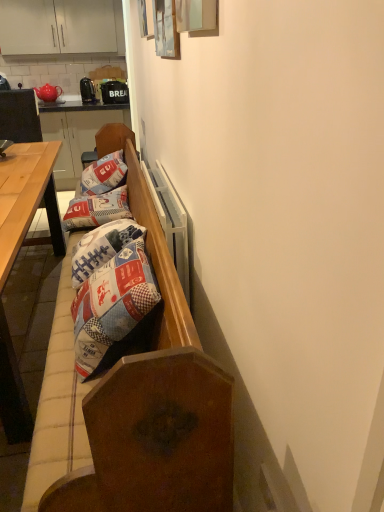
Where is `patchwork fabric pillow at center, which is the first pillow in back-to-front order`? patchwork fabric pillow at center, which is the first pillow in back-to-front order is located at coordinates (104, 174).

Where is `metallic black coffee maker at upper left`? metallic black coffee maker at upper left is located at coordinates (87, 91).

Measure the distance between wooden bench at center and camera.

They are 81.40 centimeters apart.

Identify the location of wooden desk at left. (16, 256).

Identify the location of dresser below the matte ceramic teapot at upper left (from the image's perspective). (77, 134).

Is wooden bench at left completely or partially outside of matte ceramic teapot at upper left?

Yes, wooden bench at left is not within matte ceramic teapot at upper left.

Does wooden bench at left appear on the left side of matte ceramic teapot at upper left?

Incorrect, wooden bench at left is not on the left side of matte ceramic teapot at upper left.

From a real-world perspective, which is physically below, wooden bench at left or matte ceramic teapot at upper left?

wooden bench at left is physically lower.

Is light brown wooden table at left next to matte ceramic teapot at upper left?

No.

From the image's perspective, is light brown wooden table at left located above or below matte ceramic teapot at upper left?

Based on their image positions, light brown wooden table at left is located beneath matte ceramic teapot at upper left.

Can you confirm if light brown wooden table at left is wider than matte ceramic teapot at upper left?

Yes.

Would you say light brown wooden table at left is to the left or to the right of matte ceramic teapot at upper left in the picture?

light brown wooden table at left is to the right of matte ceramic teapot at upper left.

Consider the image. Is white matte cabinet at upper left at the back of wooden desk at left?

No, wooden desk at left is not facing away from white matte cabinet at upper left.

Considering the relative sizes of wooden desk at left and white matte cabinet at upper left in the image provided, is wooden desk at left smaller than white matte cabinet at upper left?

No.

Locate an element on the screen. The height and width of the screenshot is (512, 384). desk that appears in front of the white matte cabinet at upper left is located at coordinates (16, 256).

Between wooden desk at left and white matte cabinet at upper left, which one is positioned behind?

white matte cabinet at upper left.

Which object is wider, wooden bench at center or matte ceramic teapot at upper left?

With larger width is wooden bench at center.

Which object is further away from the camera, wooden bench at center or matte ceramic teapot at upper left?

matte ceramic teapot at upper left is further from the camera.

Can you tell me how much wooden bench at center and matte ceramic teapot at upper left differ in facing direction?

wooden bench at center and matte ceramic teapot at upper left are facing 91.3 degrees away from each other.

Is wooden bench at center completely or partially outside of matte ceramic teapot at upper left?

Yes, wooden bench at center is not within matte ceramic teapot at upper left.

From a real-world perspective, which object stands above the other?

matte ceramic teapot at upper left, from a real-world perspective.

Which of these two, matte ceramic teapot at upper left or patchwork fabric pillow at center, the 2th pillow viewed from the front, is smaller?

matte ceramic teapot at upper left.

This screenshot has height=512, width=384. What are the coordinates of `coffee cup located above the patchwork fabric pillow at center, which is the first pillow in back-to-front order (from the image's perspective)` in the screenshot? It's located at (4, 83).

Is matte ceramic teapot at upper left positioned far away from patchwork fabric pillow at center, which is the first pillow in back-to-front order?

Yes, matte ceramic teapot at upper left is far from patchwork fabric pillow at center, which is the first pillow in back-to-front order.

Does white matte cabinet at upper left have a lesser width compared to wooden desk at left?

Yes, white matte cabinet at upper left is thinner than wooden desk at left.

Is white matte cabinet at upper left located outside wooden desk at left?

white matte cabinet at upper left is positioned outside wooden desk at left.

Would you say white matte cabinet at upper left is a long distance from wooden desk at left?

white matte cabinet at upper left is positioned a significant distance from wooden desk at left.

Considering the sizes of objects white matte cabinet at upper left and wooden desk at left in the image provided, who is bigger, white matte cabinet at upper left or wooden desk at left?

Bigger between the two is wooden desk at left.

Can wooden bench at left be found inside wooden desk at left?

Definitely not — wooden bench at left is not inside wooden desk at left.

Considering the relative sizes of wooden desk at left and wooden bench at left in the image provided, is wooden desk at left shorter than wooden bench at left?

Yes, wooden desk at left is shorter than wooden bench at left.

Does wooden desk at left lie in front of wooden bench at left?

Yes, wooden desk at left is closer to the viewer.

From a real-world perspective, which is physically above, wooden desk at left or wooden bench at left?

wooden bench at left, from a real-world perspective.

In the image, there is a matte ceramic teapot at upper left. At what (x,y) coordinates should I click in order to perform the action: click on dresser below it (from the image's perspective). Please return your answer as a coordinate pair (x, y). This screenshot has height=512, width=384. Looking at the image, I should click on (77, 134).

Where is `table located underneath the matte ceramic teapot at upper left (from a real-world perspective)`? table located underneath the matte ceramic teapot at upper left (from a real-world perspective) is located at coordinates [x=27, y=198].

When comparing their distances from patchwork fabric pillow at center, positioned as the second pillow in back-to-front order, does matte ceramic teapot at upper left or wooden bench at center seem further?

matte ceramic teapot at upper left is positioned further to the anchor patchwork fabric pillow at center, positioned as the second pillow in back-to-front order.

Based on their spatial positions, is patchwork fabric pillow at center, which is the first pillow in back-to-front order, or matte ceramic teapot at upper left closer to metallic black coffee maker at upper left?

matte ceramic teapot at upper left is positioned closer to the anchor metallic black coffee maker at upper left.

Which object lies nearer to the anchor point matte ceramic teapot at upper left, light brown wooden table at left or patchwork fabric pillow at center, which is the first pillow in back-to-front order?

patchwork fabric pillow at center, which is the first pillow in back-to-front order, lies closer to matte ceramic teapot at upper left than the other object.

From the image, which object appears to be farther from wooden desk at left, matte ceramic teapot at upper left or wooden bench at left?

The object further to wooden desk at left is matte ceramic teapot at upper left.

Which object lies nearer to the anchor point patchwork fabric pillow at center, positioned as the second pillow in back-to-front order, light brown wooden table at left or patchwork fabric pillow at center, the 2th pillow viewed from the front?

The object closer to patchwork fabric pillow at center, positioned as the second pillow in back-to-front order, is patchwork fabric pillow at center, the 2th pillow viewed from the front.

Looking at the image, which one is located further to white matte cabinet at upper left, matte ceramic teapot at upper left or light brown wooden table at left?

The object further to white matte cabinet at upper left is light brown wooden table at left.

When comparing their distances from light brown wooden table at left, does patchwork fabric pillow at center, which is the first pillow in back-to-front order, or matte ceramic teapot at upper left seem further?

Based on the image, matte ceramic teapot at upper left appears to be further to light brown wooden table at left.

Based on their spatial positions, is matte ceramic teapot at upper left or wooden bench at center further from wooden bench at left?

wooden bench at center is positioned further to the anchor wooden bench at left.

The image size is (384, 512). I want to click on pillow between patchwork fabric pillow at center, which is the first pillow from front to back, and metallic black coffee maker at upper left in the front-back direction, so click(x=104, y=174).

Where is `dresser positioned between patchwork fabric pillow at center, the 2th pillow viewed from the front, and metallic black coffee maker at upper left from near to far`? The height and width of the screenshot is (512, 384). dresser positioned between patchwork fabric pillow at center, the 2th pillow viewed from the front, and metallic black coffee maker at upper left from near to far is located at coordinates (77, 134).

You are a GUI agent. You are given a task and a screenshot of the screen. Output one action in this format:
    pyautogui.click(x=<x>, y=<y>)
    Task: Click on the desk located between wooden bench at center and matte ceramic teapot at upper left in the depth direction
    
    Given the screenshot: What is the action you would take?
    pyautogui.click(x=16, y=256)

You are a GUI agent. You are given a task and a screenshot of the screen. Output one action in this format:
    pyautogui.click(x=<x>, y=<y>)
    Task: Click on the pillow between patchwork fabric pillow at center, positioned as the second pillow in back-to-front order, and matte ceramic teapot at upper left in the front-back direction
    Image resolution: width=384 pixels, height=512 pixels.
    Given the screenshot: What is the action you would take?
    pyautogui.click(x=104, y=174)